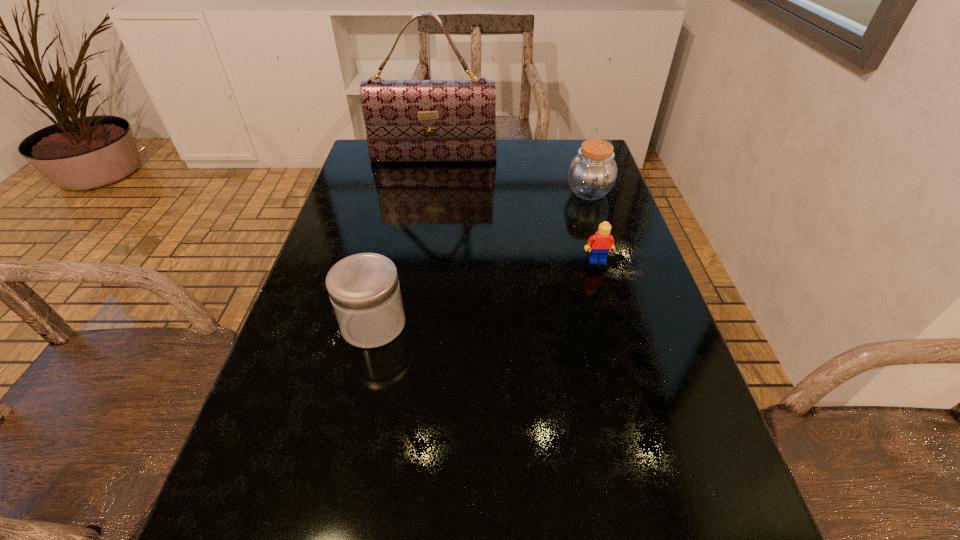
Identify the location of free space at the right edge. The width and height of the screenshot is (960, 540). (561, 192).

I want to click on free space between the handbag and the second nearest object, so click(x=516, y=210).

Image resolution: width=960 pixels, height=540 pixels. Find the location of `vacant point located between the third farthest object and the third nearest object`. vacant point located between the third farthest object and the third nearest object is located at coordinates (593, 226).

Where is `free space that is in between the farther jar and the Lego`? free space that is in between the farther jar and the Lego is located at coordinates (593, 226).

At what (x,y) coordinates should I click in order to perform the action: click on free space between the farther jar and the left jar. Please return your answer as a coordinate pair (x, y). The height and width of the screenshot is (540, 960). Looking at the image, I should click on (481, 258).

You are a GUI agent. You are given a task and a screenshot of the screen. Output one action in this format:
    pyautogui.click(x=<x>, y=<y>)
    Task: Click on the third closest object to the second farthest object
    
    Given the screenshot: What is the action you would take?
    pyautogui.click(x=364, y=290)

Select which object appears as the third closest to the third nearest object. Please provide its 2D coordinates. Your answer should be formatted as a tuple, i.e. [(x, y)], where the tuple contains the x and y coordinates of a point satisfying the conditions above.

[(364, 290)]

This screenshot has width=960, height=540. In order to click on vacant region that satisfies the following two spatial constraints: 1. on the front of the right jar with the clasp; 2. on the right side of the farthest object in this screenshot , I will do `click(428, 192)`.